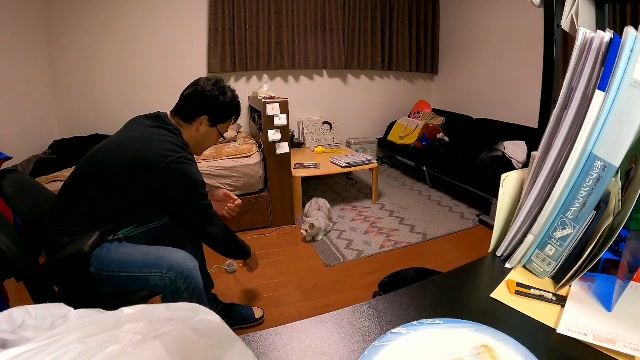
Locate an element on the screen. black sofa is located at coordinates (458, 156).